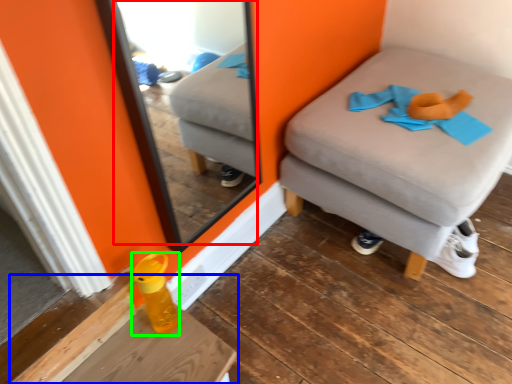
Question: Which object is the farthest from mirror (highlighted by a red box)? Choose among these: table (highlighted by a blue box) or bottle (highlighted by a green box).

Choices:
 (A) table
 (B) bottle

Answer: (B)